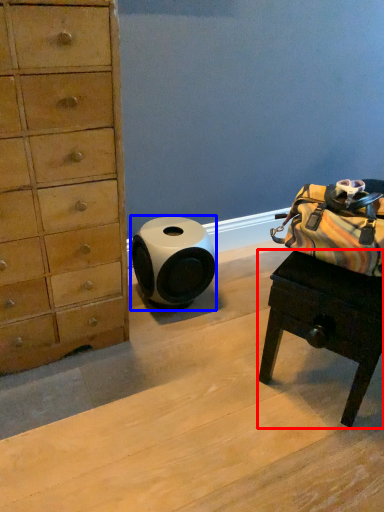
Question: Which object appears closest to the camera in this image, desk (highlighted by a red box) or speaker (highlighted by a blue box)?

Choices:
 (A) desk
 (B) speaker

Answer: (A)